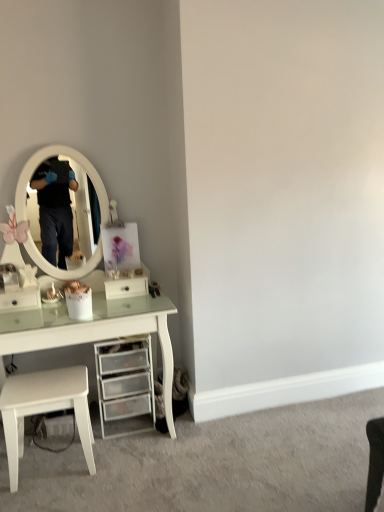
Question: Considering the positions of white matte stool at lower left and white glossy drawer at center, marked as the second drawer in a left-to-right arrangement, in the image, is white matte stool at lower left bigger or smaller than white glossy drawer at center, marked as the second drawer in a left-to-right arrangement,?

Choices:
 (A) small
 (B) big

Answer: (B)

Question: Considering the positions of white matte stool at lower left and white glossy drawer at center, the 1th drawer positioned from the right, in the image, is white matte stool at lower left taller or shorter than white glossy drawer at center, the 1th drawer positioned from the right,?

Choices:
 (A) short
 (B) tall

Answer: (B)

Question: Estimate the real-world distances between objects in this image. Which object is farther from the white glossy drawer at center, the 1th drawer positioned from the right?

Choices:
 (A) white glossy drawer at left, which is the first drawer in left-to-right order
 (B) clear plastic drawers at lower center
 (C) white matte stool at lower left

Answer: (C)

Question: Which is farther from the white matte stool at lower left?

Choices:
 (A) white glossy drawer at left, which is the first drawer in left-to-right order
 (B) white glossy drawer at center, the 1th drawer positioned from the right
 (C) clear plastic drawers at lower center

Answer: (B)